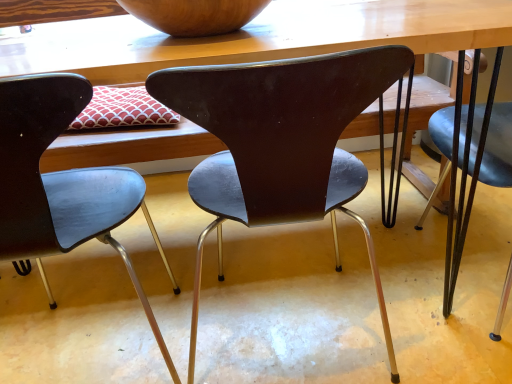
Locate an element on the screen. empty space that is ontop of matte black chair at center, positioned as the 2th chair in left-to-right order (from a real-world perspective) is located at coordinates (275, 44).